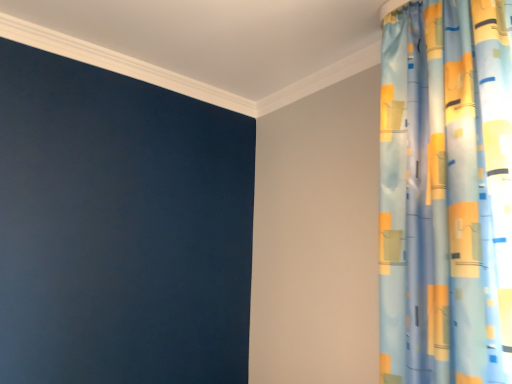
This screenshot has height=384, width=512. What do you see at coordinates (445, 193) in the screenshot?
I see `light blue printed fabric curtain at right` at bounding box center [445, 193].

This screenshot has width=512, height=384. I want to click on light blue printed fabric curtain at right, so click(445, 193).

What is the approximate width of light blue printed fabric curtain at right?

The width of light blue printed fabric curtain at right is 11.39 inches.

I want to click on light blue printed fabric curtain at right, so click(445, 193).